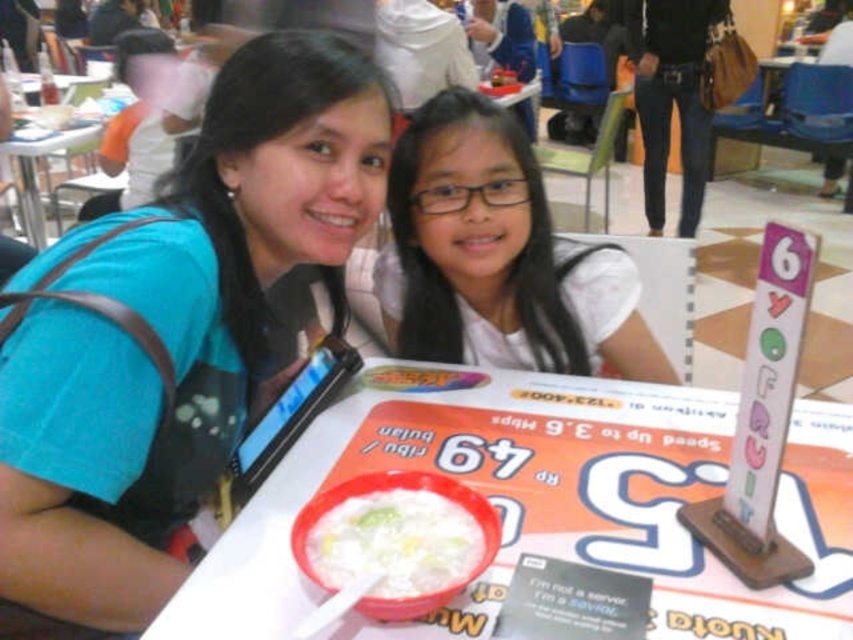
Question: Does white paperboard at center appear on the left side of white matte hair at center?

Choices:
 (A) yes
 (B) no

Answer: (B)

Question: Does white matte hair at center lie in front of white plastic table at upper left?

Choices:
 (A) no
 (B) yes

Answer: (B)

Question: Which of the following is the closest to the observer?

Choices:
 (A) white paperboard at center
 (B) white creamy porridge at center
 (C) white matte hair at center
 (D) white plastic table at upper left

Answer: (B)

Question: Which point appears farthest from the camera in this image?

Choices:
 (A) (496, 266)
 (B) (408, 538)
 (C) (592, 506)
 (D) (158, 609)

Answer: (A)

Question: Is white paperboard at center to the left of white creamy porridge at center from the viewer's perspective?

Choices:
 (A) yes
 (B) no

Answer: (B)

Question: Among these points, which one is nearest to the camera?

Choices:
 (A) (3, 120)
 (B) (422, 580)
 (C) (178, 481)
 (D) (753, 621)

Answer: (B)